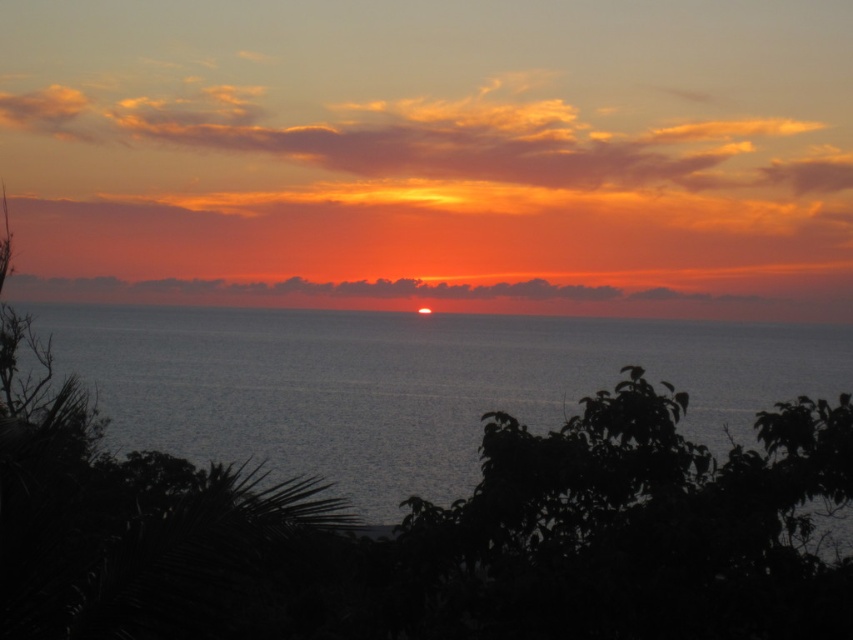
You are a photographer standing at the shore facing the sunset. You notice the blue water at center and the smooth ocean at center in your viewfinder. Which one appears closer to you in the scene?

The blue water at center appears closer to you because it is positioned in front of the smooth ocean at center.

You are standing on a boat in the middle of the sea and notice two distinct areas of water ahead. The blue water at center and the smooth ocean at center are both visible. Given that the distance between them is 138.90 feet, can you safely navigate a boat that requires at least 150 feet of clearance between such areas to avoid turbulence?

The blue water at center and smooth ocean at center are 138.90 feet apart, which is less than the required 150 feet clearance. Therefore, navigating the boat between them may not be safe due to insufficient distance to avoid turbulence.